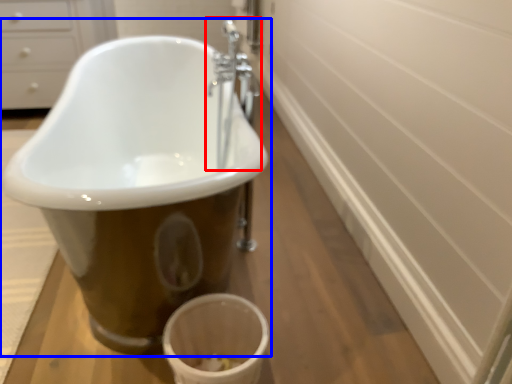
Question: Which object is further to the camera taking this photo, tap (highlighted by a red box) or bathtub (highlighted by a blue box)?

Choices:
 (A) tap
 (B) bathtub

Answer: (A)